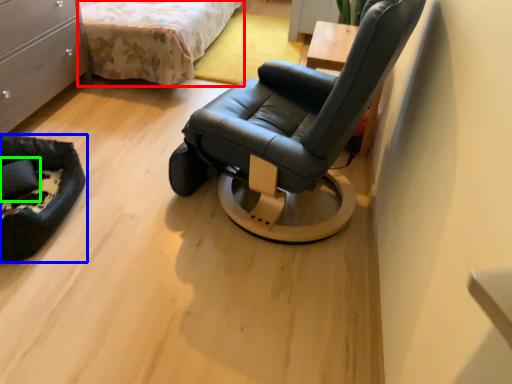
Question: Which object is positioned farthest from bed (highlighted by a red box)? Select from furniture (highlighted by a blue box) and pillow (highlighted by a green box).

Choices:
 (A) furniture
 (B) pillow

Answer: (B)